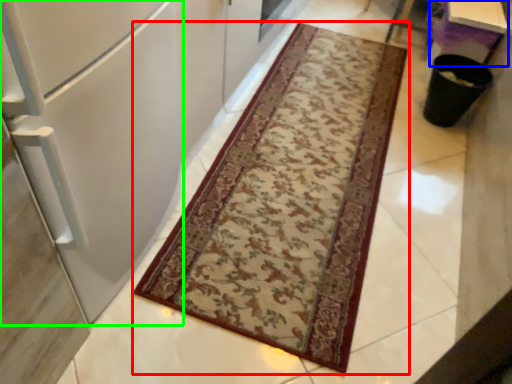
Question: Which object is the closest to the mat (highlighted by a red box)? Choose among these: table (highlighted by a blue box) or fridge (highlighted by a green box).

Choices:
 (A) table
 (B) fridge

Answer: (B)